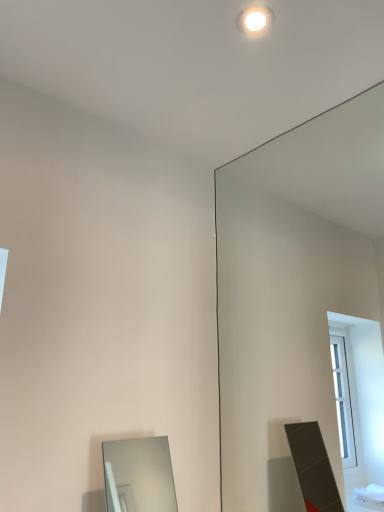
Question: Is clear glass mirror at upper right, which ranks as the first mirror in right-to-left order, a part of white glossy light fixture at upper center?

Choices:
 (A) no
 (B) yes

Answer: (A)

Question: Would you say white glossy light fixture at upper center is outside clear glass mirror at upper right, which ranks as the first mirror in right-to-left order?

Choices:
 (A) yes
 (B) no

Answer: (A)

Question: From a real-world perspective, is white glossy light fixture at upper center physically below clear glass mirror at upper right, the 2th mirror from the left?

Choices:
 (A) no
 (B) yes

Answer: (A)

Question: Is white glossy light fixture at upper center beside clear glass mirror at upper right, the 2th mirror from the left?

Choices:
 (A) no
 (B) yes

Answer: (A)

Question: Is white glossy light fixture at upper center thinner than clear glass mirror at upper right, which ranks as the first mirror in right-to-left order?

Choices:
 (A) yes
 (B) no

Answer: (B)

Question: From the image's perspective, does white glossy light fixture at upper center appear higher than clear glass mirror at upper right, which ranks as the first mirror in right-to-left order?

Choices:
 (A) yes
 (B) no

Answer: (A)

Question: Does smooth silver mirror at lower left, acting as the 2th mirror starting from the right, have a larger size compared to white glossy light fixture at upper center?

Choices:
 (A) no
 (B) yes

Answer: (B)

Question: Would you say smooth silver mirror at lower left, acting as the 2th mirror starting from the right, contains white glossy light fixture at upper center?

Choices:
 (A) yes
 (B) no

Answer: (B)

Question: Is smooth silver mirror at lower left, acting as the 2th mirror starting from the right, further to the viewer compared to white glossy light fixture at upper center?

Choices:
 (A) no
 (B) yes

Answer: (A)

Question: Is smooth silver mirror at lower left, arranged as the 1th mirror when viewed from the left, far from white glossy light fixture at upper center?

Choices:
 (A) no
 (B) yes

Answer: (B)

Question: Is smooth silver mirror at lower left, arranged as the 1th mirror when viewed from the left, positioned with its back to white glossy light fixture at upper center?

Choices:
 (A) yes
 (B) no

Answer: (B)

Question: Is smooth silver mirror at lower left, arranged as the 1th mirror when viewed from the left, facing towards white glossy light fixture at upper center?

Choices:
 (A) yes
 (B) no

Answer: (B)

Question: Is clear glass mirror at upper right, which ranks as the first mirror in right-to-left order, facing away from white glossy light fixture at upper center?

Choices:
 (A) no
 (B) yes

Answer: (A)